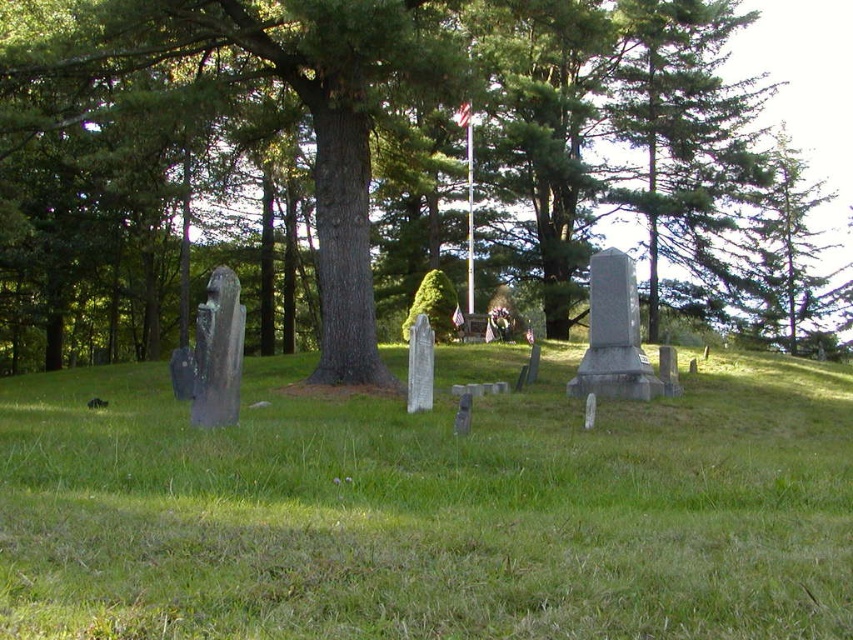
You are standing in the cemetery and want to place a new gravestone between the green grassy at center and the green textured tree at center. Based on their positions, which object should the gravestone be closer to?

The gravestone should be placed closer to the green textured tree at center because the green grassy at center is to the left of the green textured tree at center, meaning the tree is to the right of the grassy area. Therefore, placing the gravestone between them would require it to be closer to the tree if positioned towards the right side between the two.

You are standing in the cemetery and want to place a new small flowerpot between the green grassy at center and the green textured tree at center. Which object should you place it closer to so that it fits better in the scene?

The green grassy at center is smaller than the green textured tree at center, so placing the flowerpot closer to the green grassy at center would maintain proportion and fit better with the scale of the scene.